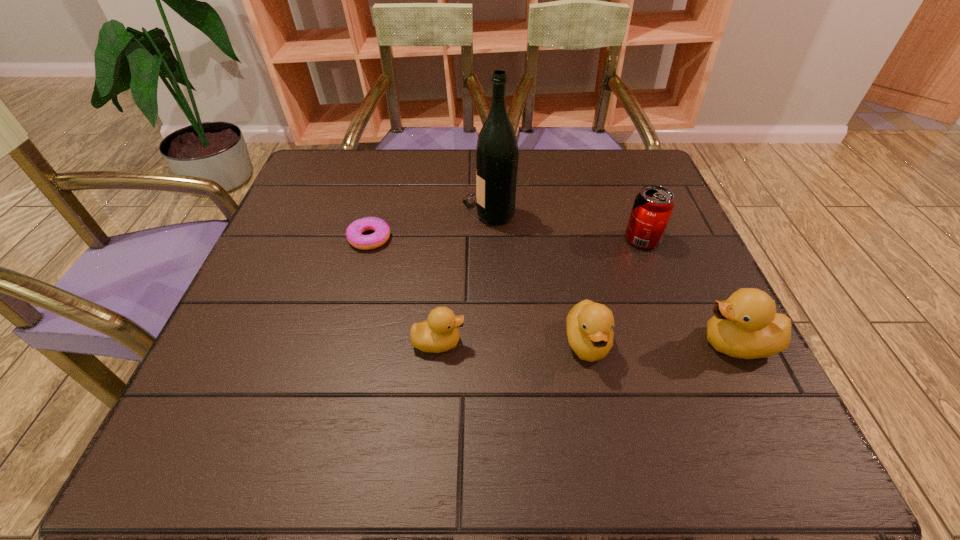
The image size is (960, 540). Find the location of `free space that satisfies the following two spatial constraints: 1. on the front side of the wine bottle; 2. on the face of the second shortest object`. free space that satisfies the following two spatial constraints: 1. on the front side of the wine bottle; 2. on the face of the second shortest object is located at coordinates (491, 342).